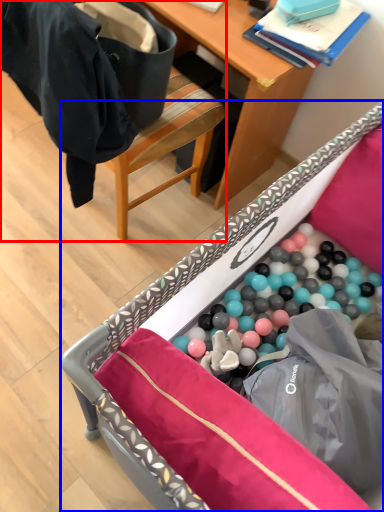
Question: Which of the following is the farthest to the observer, chair (highlighted by a red box) or furniture (highlighted by a blue box)?

Choices:
 (A) chair
 (B) furniture

Answer: (A)